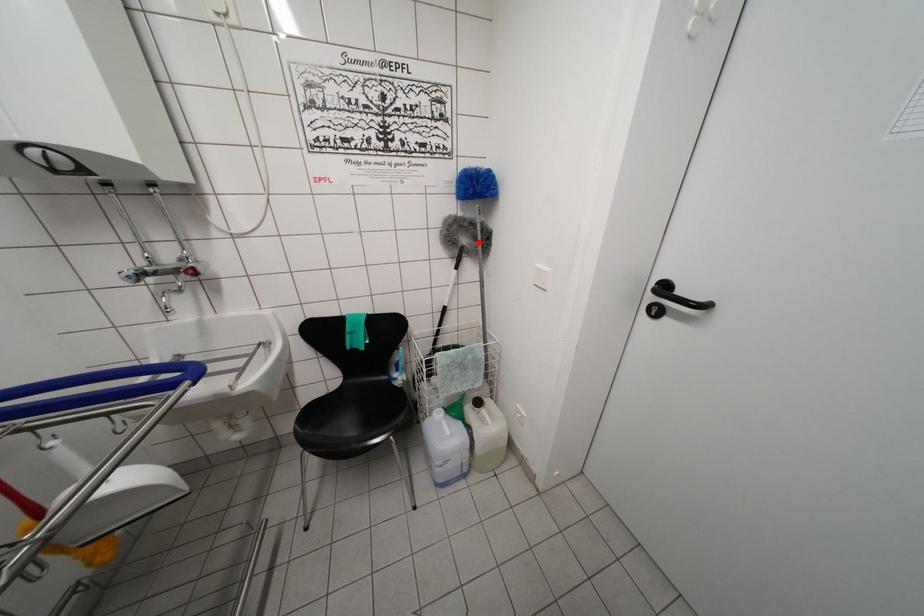
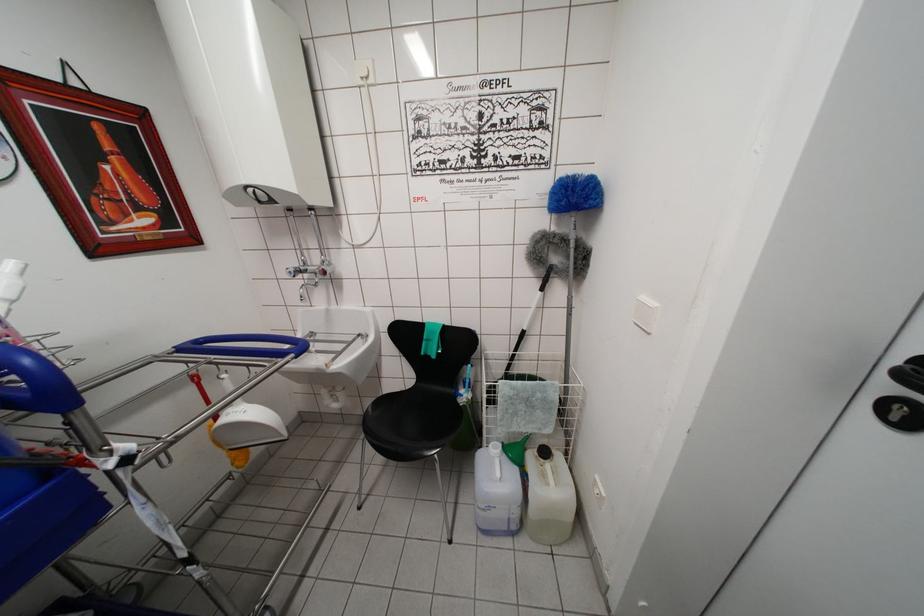
In the second image, find the point that corresponds to the highlighted location in the first image.

(572, 261)